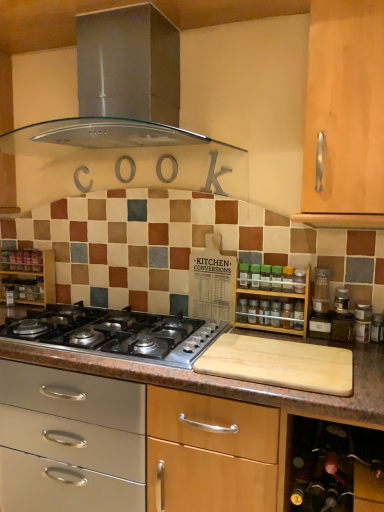
Measure the distance between wooden spice rack at center and camera.

They are 5.51 feet apart.

In order to click on polished stainless steel gas stove at center in this screenshot , I will do `click(116, 333)`.

Where is `wooden spice rack at center`? wooden spice rack at center is located at coordinates (264, 313).

From the image's perspective, relative to polished stainless steel gas stove at center, is transparent glass spice at center, the second bottle when ordered from front to back, above or below?

transparent glass spice at center, the second bottle when ordered from front to back, is situated higher than polished stainless steel gas stove at center in the image.

Considering the relative positions of transparent glass spice at center, the 2th bottle in the right-to-left sequence, and polished stainless steel gas stove at center in the image provided, is transparent glass spice at center, the 2th bottle in the right-to-left sequence, in front of polished stainless steel gas stove at center?

No.

Consider the image. Is transparent glass spice at center, arranged as the first bottle when ordered from the bottom, oriented towards polished stainless steel gas stove at center?

No, transparent glass spice at center, arranged as the first bottle when ordered from the bottom, is not facing towards polished stainless steel gas stove at center.

Is transparent glass spice at center, the second bottle when ordered from front to back, wider than polished stainless steel gas stove at center?

Incorrect, the width of transparent glass spice at center, the second bottle when ordered from front to back, does not surpass that of polished stainless steel gas stove at center.

From the image's perspective, does green glass spice at center, marked as the second bottle in a bottom-to-top arrangement, appear lower than wooden spice rack at right, the 1th shelf viewed from the front?

Incorrect, from the image's perspective, green glass spice at center, marked as the second bottle in a bottom-to-top arrangement, is higher than wooden spice rack at right, the 1th shelf viewed from the front.

Would you say green glass spice at center, marked as the first bottle in a top-to-bottom arrangement, is inside or outside wooden spice rack at right, arranged as the 2th shelf when viewed from the back?

green glass spice at center, marked as the first bottle in a top-to-bottom arrangement, is enclosed within wooden spice rack at right, arranged as the 2th shelf when viewed from the back.

Is green glass spice at center, marked as the second bottle in a bottom-to-top arrangement, facing away from wooden spice rack at right, arranged as the 2th shelf when viewed from the back?

That's right, green glass spice at center, marked as the second bottle in a bottom-to-top arrangement, is facing away from wooden spice rack at right, arranged as the 2th shelf when viewed from the back.

Can you tell me how much green glass spice at center, marked as the second bottle in a bottom-to-top arrangement, and wooden spice rack at right, the 1th shelf viewed from the front, differ in facing direction?

The facing directions of green glass spice at center, marked as the second bottle in a bottom-to-top arrangement, and wooden spice rack at right, the 1th shelf viewed from the front, are 1.39 degrees apart.

Does wooden spice rack at center have a larger size compared to green glass spice at center, the 2th bottle from the back?

Incorrect, wooden spice rack at center is not larger than green glass spice at center, the 2th bottle from the back.

From the image's perspective, is wooden spice rack at center positioned above or below green glass spice at center, the first bottle positioned from the front?

wooden spice rack at center is below green glass spice at center, the first bottle positioned from the front.

Which object is positioned more to the right, wooden spice rack at center or green glass spice at center, marked as the first bottle in a top-to-bottom arrangement?

From the viewer's perspective, green glass spice at center, marked as the first bottle in a top-to-bottom arrangement, appears more on the right side.

Is wooden spice rack at center outside of green glass spice at center, which is the second bottle in left-to-right order?

That's correct, wooden spice rack at center is outside of green glass spice at center, which is the second bottle in left-to-right order.

Based on the photo, are wooden spice rack at right, acting as the second shelf starting from the left, and wooden spice rack at center located far from each other?

No, wooden spice rack at right, acting as the second shelf starting from the left, is not far from wooden spice rack at center.

How distant is wooden spice rack at right, acting as the second shelf starting from the left, from wooden spice rack at center?

A distance of 2.77 inches exists between wooden spice rack at right, acting as the second shelf starting from the left, and wooden spice rack at center.

Does point (279, 315) appear closer or farther from the camera than point (264, 310)?

Point (279, 315) is closer to the camera than point (264, 310).

In the scene shown: Is green glass spice at center, marked as the first bottle in a top-to-bottom arrangement, in front of or behind polished stainless steel gas stove at center in the image?

In the image, green glass spice at center, marked as the first bottle in a top-to-bottom arrangement, appears behind polished stainless steel gas stove at center.

Considering the points (266, 271) and (30, 313), which point is in front, point (266, 271) or point (30, 313)?

Positioned in front is point (266, 271).

Is green glass spice at center, marked as the second bottle in a bottom-to-top arrangement, to the left of polished stainless steel gas stove at center from the viewer's perspective?

In fact, green glass spice at center, marked as the second bottle in a bottom-to-top arrangement, is to the right of polished stainless steel gas stove at center.

From the image's perspective, is green glass spice at center, the 2th bottle from the back, below polished stainless steel gas stove at center?

Actually, green glass spice at center, the 2th bottle from the back, appears above polished stainless steel gas stove at center in the image.

Which is correct: wooden shelf at left, the 2th shelf in the right-to-left sequence, is inside green glass spice at center, arranged as the first bottle when viewed from the right, or outside of it?

wooden shelf at left, the 2th shelf in the right-to-left sequence, is spatially situated outside green glass spice at center, arranged as the first bottle when viewed from the right.

In the scene shown: Is wooden shelf at left, the 2th shelf in the right-to-left sequence, bigger or smaller than green glass spice at center, the 2th bottle from the back?

wooden shelf at left, the 2th shelf in the right-to-left sequence, is bigger than green glass spice at center, the 2th bottle from the back.

There is a wooden shelf at left, the 2th shelf in the right-to-left sequence. Find the location of `bottle above it (from a real-world perspective)`. bottle above it (from a real-world perspective) is located at coordinates (265, 277).

From the image's perspective, which is below, wooden shelf at left, the 1th shelf in the back-to-front sequence, or green glass spice at center, marked as the first bottle in a top-to-bottom arrangement?

wooden shelf at left, the 1th shelf in the back-to-front sequence, appears lower in the image.

Considering the relative sizes of green glass spice at center, marked as the first bottle in a top-to-bottom arrangement, and wooden spice rack at center in the image provided, is green glass spice at center, marked as the first bottle in a top-to-bottom arrangement, shorter than wooden spice rack at center?

Correct, green glass spice at center, marked as the first bottle in a top-to-bottom arrangement, is not as tall as wooden spice rack at center.

Could you tell me if green glass spice at center, which is the second bottle in left-to-right order, is facing wooden spice rack at center?

No, green glass spice at center, which is the second bottle in left-to-right order, is not turned towards wooden spice rack at center.

Is green glass spice at center, which is the second bottle in left-to-right order, inside the boundaries of wooden spice rack at center, or outside?

green glass spice at center, which is the second bottle in left-to-right order, is not inside wooden spice rack at center, it's outside.

Between green glass spice at center, which is the second bottle in left-to-right order, and wooden spice rack at center, which one appears on the left side from the viewer's perspective?

wooden spice rack at center.

Find the location of a particular element. The image size is (384, 512). the 1st bottle above the polished stainless steel gas stove at center (from a real-world perspective) is located at coordinates (242, 310).

From the wooden spice rack at right, arranged as the 2th shelf when viewed from the back, count 1st bottles backward and point to it. Please provide its 2D coordinates.

[(265, 277)]

When comparing their distances from green glass spice at center, marked as the first bottle in a top-to-bottom arrangement, does wooden shelf at left, which ranks as the 2th shelf in front-to-back order, or polished stainless steel gas stove at center seem further?

Based on the image, wooden shelf at left, which ranks as the 2th shelf in front-to-back order, appears to be further to green glass spice at center, marked as the first bottle in a top-to-bottom arrangement.

When comparing their distances from transparent glass spice at center, the first bottle from the left, does wooden spice rack at center or wooden spice rack at right, arranged as the 2th shelf when viewed from the back, seem further?

The object further to transparent glass spice at center, the first bottle from the left, is wooden spice rack at right, arranged as the 2th shelf when viewed from the back.

Based on their spatial positions, is wooden shelf at left, the 2th shelf in the right-to-left sequence, or wooden spice rack at right, arranged as the 2th shelf when viewed from the back, closer to wooden spice rack at center?

Based on the image, wooden spice rack at right, arranged as the 2th shelf when viewed from the back, appears to be nearer to wooden spice rack at center.

Which object lies nearer to the anchor point green glass spice at center, the 2th bottle from the back, stainless steel range hood at upper center or polished stainless steel gas stove at center?

polished stainless steel gas stove at center is positioned closer to the anchor green glass spice at center, the 2th bottle from the back.

Which object lies further to the anchor point polished stainless steel gas stove at center, green glass spice at center, marked as the second bottle in a bottom-to-top arrangement, or wooden shelf at left, arranged as the 1th shelf when viewed from the left?

The object further to polished stainless steel gas stove at center is green glass spice at center, marked as the second bottle in a bottom-to-top arrangement.

Estimate the real-world distances between objects in this image. Which object is further from stainless steel range hood at upper center, wooden spice rack at center or polished stainless steel gas stove at center?

The object further to stainless steel range hood at upper center is wooden spice rack at center.

Based on their spatial positions, is wooden shelf at left, the 2th shelf in the right-to-left sequence, or stainless steel range hood at upper center closer to polished stainless steel gas stove at center?

Among the two, wooden shelf at left, the 2th shelf in the right-to-left sequence, is located nearer to polished stainless steel gas stove at center.

From the picture: Looking at the image, which one is located closer to wooden spice rack at center, transparent glass spice at center, positioned as the second bottle in top-to-bottom order, or green glass spice at center, marked as the first bottle in a top-to-bottom arrangement?

transparent glass spice at center, positioned as the second bottle in top-to-bottom order, lies closer to wooden spice rack at center than the other object.

Find the location of a particular element. The image size is (384, 512). gas stove between wooden shelf at left, the 1th shelf in the back-to-front sequence, and wooden spice rack at center, in the horizontal direction is located at coordinates (116, 333).

Where is `appliance between stainless steel range hood at upper center and polished stainless steel gas stove at center in the up-down direction`? appliance between stainless steel range hood at upper center and polished stainless steel gas stove at center in the up-down direction is located at coordinates (264, 313).

You are a GUI agent. You are given a task and a screenshot of the screen. Output one action in this format:
    pyautogui.click(x=<x>, y=<y>)
    Task: Click on the bottle between polished stainless steel gas stove at center and green glass spice at center, the 2th bottle from the back, from left to right
    
    Given the screenshot: What is the action you would take?
    pyautogui.click(x=242, y=310)

The height and width of the screenshot is (512, 384). I want to click on bottle that lies between stainless steel range hood at upper center and transparent glass spice at center, the first bottle from the left, from top to bottom, so coord(265,277).